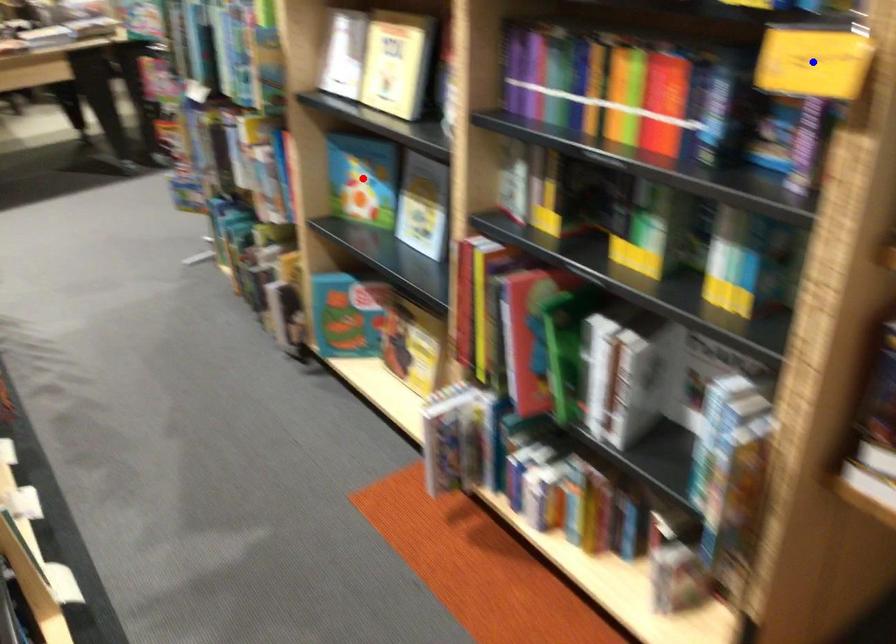
Question: Two points are marked on the image. Which point is closer to the camera?

Choices:
 (A) Blue point is closer.
 (B) Red point is closer.

Answer: (A)